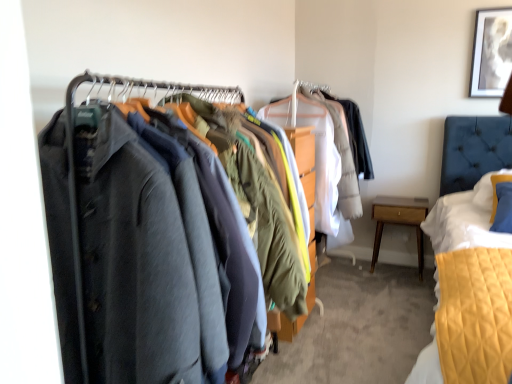
I want to click on white paper at upper right, so click(490, 52).

This screenshot has height=384, width=512. What do you see at coordinates (490, 52) in the screenshot?
I see `white paper at upper right` at bounding box center [490, 52].

What do you see at coordinates (155, 242) in the screenshot? I see `matte black coat at left` at bounding box center [155, 242].

Describe the element at coordinates (399, 221) in the screenshot. I see `light wood/finely crafted nightstand at lower right` at that location.

You are a GUI agent. You are given a task and a screenshot of the screen. Output one action in this format:
    pyautogui.click(x=<x>, y=<y>)
    Task: Click on the white paper at upper right
    The width and height of the screenshot is (512, 384).
    Given the screenshot: What is the action you would take?
    pyautogui.click(x=490, y=52)

Is white paper at upper right bigger or smaller than light wood/finely crafted nightstand at lower right?

Considering their sizes, white paper at upper right takes up less space than light wood/finely crafted nightstand at lower right.

Is white paper at upper right inside or outside of light wood/finely crafted nightstand at lower right?

white paper at upper right is outside light wood/finely crafted nightstand at lower right.

Consider the image. Which point is more distant from viewer, (x=490, y=91) or (x=399, y=209)?

The point (x=399, y=209) is farther from the camera.

At what (x,y) coordinates should I click in order to perform the action: click on nightstand below the white paper at upper right (from the image's perspective). Please return your answer as a coordinate pair (x, y). This screenshot has height=384, width=512. Looking at the image, I should click on (399, 221).

How different are the orientations of matte black coat at left and white paper at upper right in degrees?

matte black coat at left and white paper at upper right are facing 89.2 degrees away from each other.

Between matte black coat at left and white paper at upper right, which one has smaller width?

With smaller width is white paper at upper right.

In the scene shown: Is matte black coat at left taller than white paper at upper right?

Correct, matte black coat at left is much taller as white paper at upper right.

Is matte black coat at left bigger or smaller than white paper at upper right?

In the image, matte black coat at left appears to be larger than white paper at upper right.

Is matte black coat at left thinner than light wood/finely crafted nightstand at lower right?

In fact, matte black coat at left might be wider than light wood/finely crafted nightstand at lower right.

Where is `closet above the light wood/finely crafted nightstand at lower right (from the image's perspective)`? closet above the light wood/finely crafted nightstand at lower right (from the image's perspective) is located at coordinates (155, 242).

Is matte black coat at left facing towards light wood/finely crafted nightstand at lower right?

No, matte black coat at left is not turned towards light wood/finely crafted nightstand at lower right.

In the scene shown: Which object is further away from the camera, matte black coat at left or light wood/finely crafted nightstand at lower right?

light wood/finely crafted nightstand at lower right is behind.

Identify the location of picture frame above the light wood/finely crafted nightstand at lower right (from a real-world perspective). Image resolution: width=512 pixels, height=384 pixels. (490, 52).

From the image's perspective, which one is positioned lower, light wood/finely crafted nightstand at lower right or white paper at upper right?

light wood/finely crafted nightstand at lower right appears lower in the image.

Is point (405, 207) closer to viewer compared to point (490, 41)?

No.

Is light wood/finely crafted nightstand at lower right not inside white paper at upper right?

light wood/finely crafted nightstand at lower right is positioned outside white paper at upper right.

Is point (415, 223) positioned behind point (197, 322)?

Yes, it is.

Could you tell me if light wood/finely crafted nightstand at lower right is turned towards matte black coat at left?

Yes, light wood/finely crafted nightstand at lower right is aimed at matte black coat at left.

Consider the image. Does light wood/finely crafted nightstand at lower right have a larger size compared to matte black coat at left?

No, light wood/finely crafted nightstand at lower right is not bigger than matte black coat at left.

Is white paper at upper right located outside matte black coat at left?

That's correct, white paper at upper right is outside of matte black coat at left.

Where is `picture frame behind the matte black coat at left`? picture frame behind the matte black coat at left is located at coordinates (x=490, y=52).

Which is behind, white paper at upper right or matte black coat at left?

white paper at upper right.

Considering the positions of point (507, 45) and point (230, 211), is point (507, 45) closer or farther from the camera than point (230, 211)?

Point (507, 45) is positioned farther from the camera compared to point (230, 211).

Identify the location of picture frame to the right of light wood/finely crafted nightstand at lower right. The width and height of the screenshot is (512, 384). (490, 52).

Where is `closet that appears below the white paper at upper right (from the image's perspective)`? This screenshot has width=512, height=384. closet that appears below the white paper at upper right (from the image's perspective) is located at coordinates (155, 242).

When comparing their distances from light wood/finely crafted nightstand at lower right, does matte black coat at left or white paper at upper right seem closer?

Among the two, white paper at upper right is located nearer to light wood/finely crafted nightstand at lower right.

Looking at the image, which one is located further to matte black coat at left, light wood/finely crafted nightstand at lower right or white paper at upper right?

Based on the image, white paper at upper right appears to be further to matte black coat at left.

Considering their positions, is matte black coat at left positioned closer to white paper at upper right than light wood/finely crafted nightstand at lower right?

light wood/finely crafted nightstand at lower right is positioned closer to the anchor white paper at upper right.

Looking at this image, which object lies further to the anchor point light wood/finely crafted nightstand at lower right, white paper at upper right or matte black coat at left?

matte black coat at left is positioned further to the anchor light wood/finely crafted nightstand at lower right.

From the image, which object appears to be nearer to matte black coat at left, white paper at upper right or light wood/finely crafted nightstand at lower right?

light wood/finely crafted nightstand at lower right.

Considering their positions, is light wood/finely crafted nightstand at lower right positioned further to white paper at upper right than matte black coat at left?

Among the two, matte black coat at left is located further to white paper at upper right.

Identify the location of picture frame between matte black coat at left and light wood/finely crafted nightstand at lower right in the front-back direction. (490, 52).